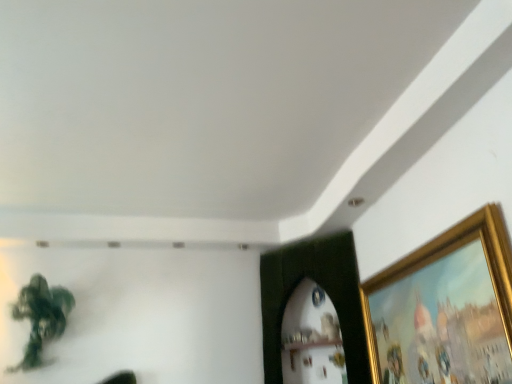
Question: Is gold metallic picture frame at upper right next to green matte plant at upper left and touching it?

Choices:
 (A) no
 (B) yes

Answer: (A)

Question: Considering the relative positions of gold metallic picture frame at upper right and green matte plant at upper left in the image provided, is gold metallic picture frame at upper right to the right of green matte plant at upper left from the viewer's perspective?

Choices:
 (A) no
 (B) yes

Answer: (B)

Question: Does gold metallic picture frame at upper right have a lesser width compared to green matte plant at upper left?

Choices:
 (A) yes
 (B) no

Answer: (A)

Question: From a real-world perspective, does gold metallic picture frame at upper right stand above green matte plant at upper left?

Choices:
 (A) yes
 (B) no

Answer: (B)

Question: From a real-world perspective, does gold metallic picture frame at upper right sit lower than green matte plant at upper left?

Choices:
 (A) yes
 (B) no

Answer: (A)

Question: Considering the relative sizes of gold metallic picture frame at upper right and green matte plant at upper left in the image provided, is gold metallic picture frame at upper right wider than green matte plant at upper left?

Choices:
 (A) yes
 (B) no

Answer: (B)

Question: Does green matte plant at upper left contain gold metallic picture frame at upper right?

Choices:
 (A) yes
 (B) no

Answer: (B)

Question: Can you confirm if green matte plant at upper left is smaller than gold metallic picture frame at upper right?

Choices:
 (A) yes
 (B) no

Answer: (B)

Question: Is green matte plant at upper left wider than gold metallic picture frame at upper right?

Choices:
 (A) no
 (B) yes

Answer: (B)

Question: Is green matte plant at upper left oriented towards gold metallic picture frame at upper right?

Choices:
 (A) no
 (B) yes

Answer: (A)

Question: Is green matte plant at upper left oriented away from gold metallic picture frame at upper right?

Choices:
 (A) no
 (B) yes

Answer: (A)

Question: Considering the relative positions of green matte plant at upper left and gold metallic picture frame at upper right in the image provided, is green matte plant at upper left in front of gold metallic picture frame at upper right?

Choices:
 (A) no
 (B) yes

Answer: (A)

Question: Is gold metallic picture frame at upper right in front of or behind green matte plant at upper left in the image?

Choices:
 (A) behind
 (B) front

Answer: (B)